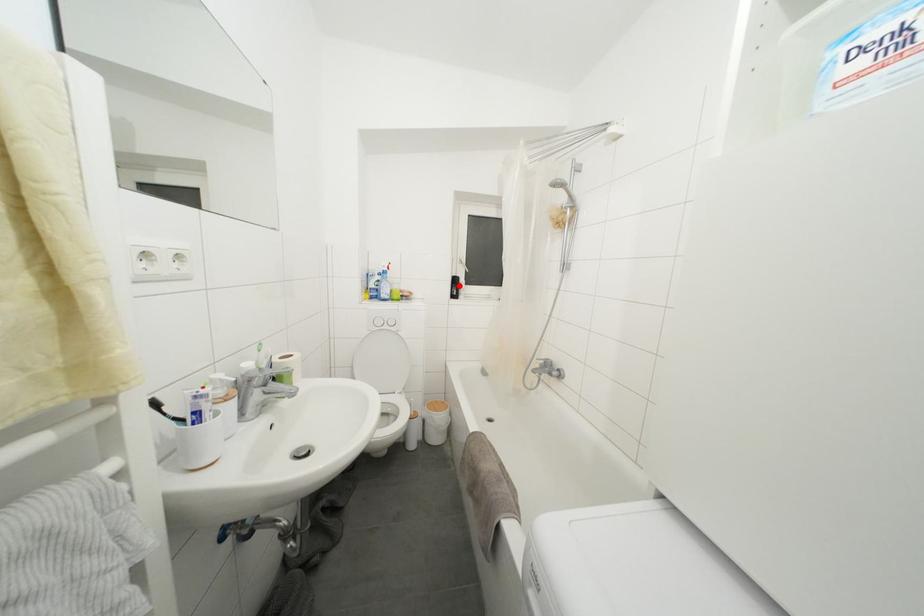
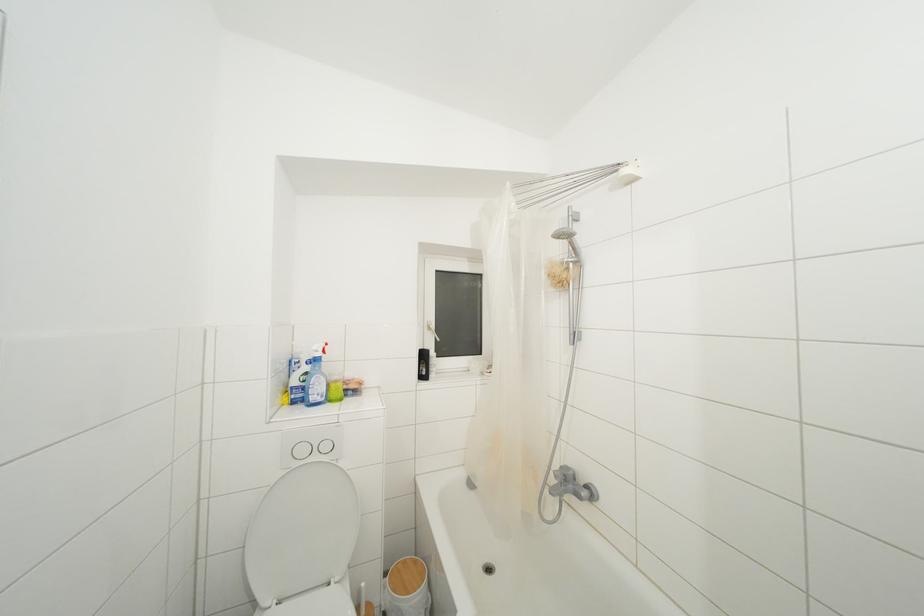
Where in the second image is the point corresponding to the highlighted location from the first image?

(428, 361)